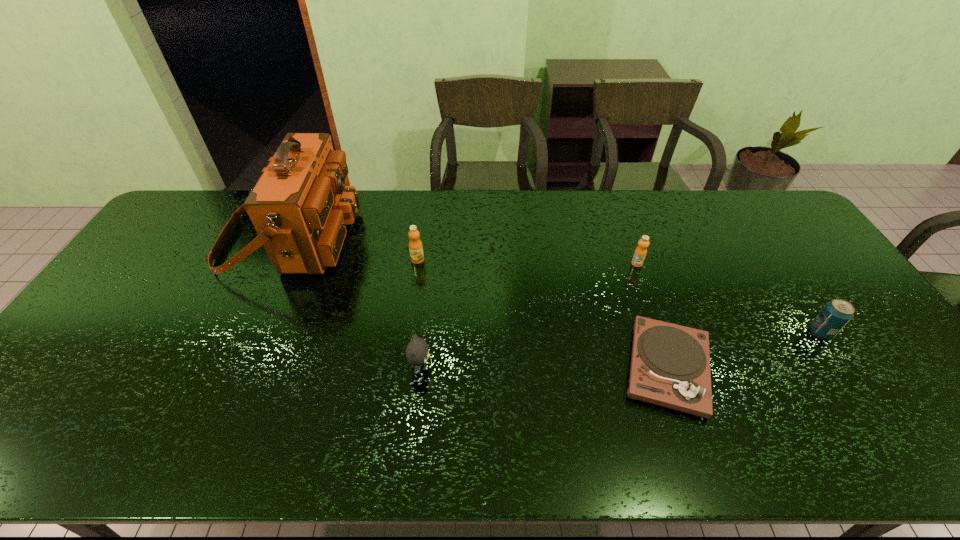
The image size is (960, 540). Identify the location of blank space at the near right corner of the desktop. (924, 442).

This screenshot has width=960, height=540. In order to click on empty space that is in between the pop soda and the phonograph_record in this screenshot , I will do `click(744, 349)`.

The image size is (960, 540). I want to click on empty space between the shorter orange juice and the pop soda, so click(729, 298).

The image size is (960, 540). I want to click on free space between the satchel and the pop soda, so click(556, 286).

Locate an element on the screen. free space between the left orange juice and the shortest object is located at coordinates (542, 313).

At what (x,y) coordinates should I click in order to perform the action: click on empty space between the tallest object and the left orange juice. Please return your answer as a coordinate pair (x, y). Image resolution: width=960 pixels, height=540 pixels. Looking at the image, I should click on coord(353,249).

Where is `free space between the second tallest object and the shortest object`? free space between the second tallest object and the shortest object is located at coordinates (542, 313).

This screenshot has width=960, height=540. Identify the location of empty space between the pop soda and the left orange juice. (619, 296).

In order to click on vacant area between the right orange juice and the tallest object in this screenshot , I will do `click(464, 251)`.

Identify the location of free space between the taller orange juice and the shorter orange juice. pyautogui.click(x=527, y=261).